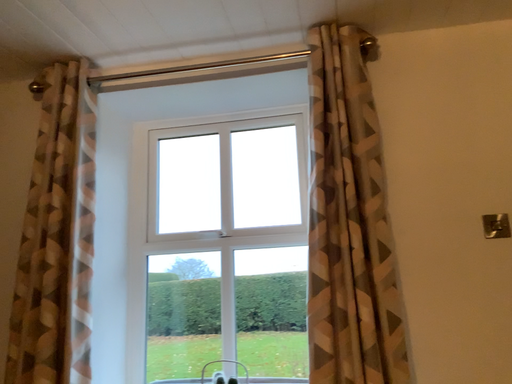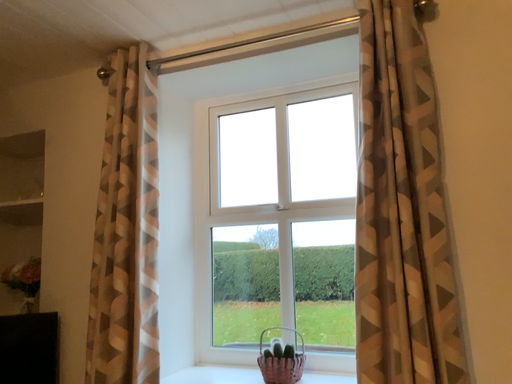
Question: How did the camera likely rotate when shooting the video?

Choices:
 (A) rotated left
 (B) rotated right

Answer: (A)